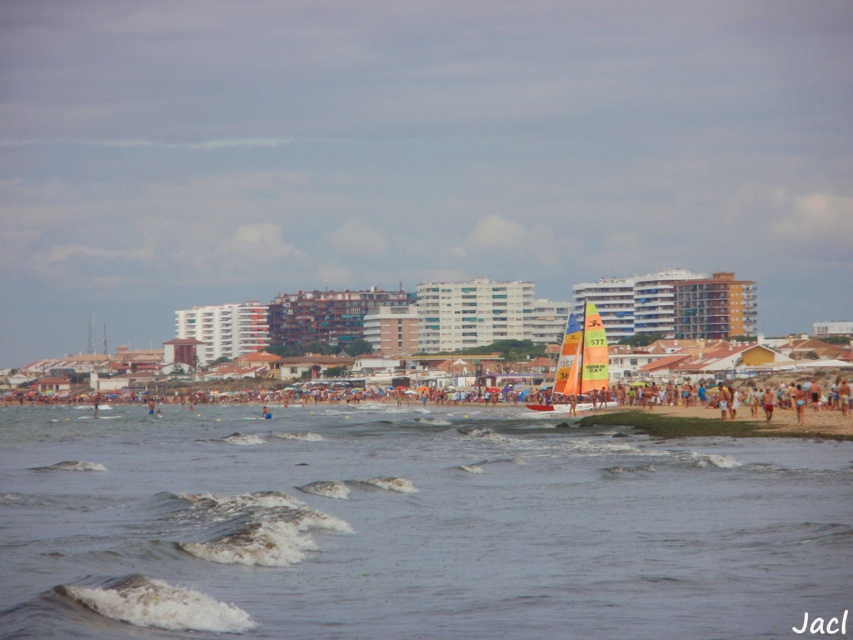
Can you confirm if clear water at lower center is thinner than multicolored sailboat at center?

No, clear water at lower center is not thinner than multicolored sailboat at center.

Between clear water at lower center and multicolored sailboat at center, which one appears on the left side from the viewer's perspective?

clear water at lower center is more to the left.

Describe the element at coordinates (410, 525) in the screenshot. The image size is (853, 640). I see `clear water at lower center` at that location.

Locate an element on the screen. This screenshot has width=853, height=640. clear water at lower center is located at coordinates (410, 525).

Between orange fabric sailboat at center and multicolored sailboat at center, which one is positioned lower?

Positioned lower is orange fabric sailboat at center.

Does orange fabric sailboat at center have a larger size compared to multicolored sailboat at center?

Yes, orange fabric sailboat at center is bigger than multicolored sailboat at center.

Measure the distance between orange fabric sailboat at center and camera.

orange fabric sailboat at center is 380.58 feet from camera.

In order to click on orange fabric sailboat at center in this screenshot , I will do `click(672, 410)`.

Is point (231, 577) farther from camera compared to point (663, 406)?

No, it is in front of (663, 406).

Describe the element at coordinates (410, 525) in the screenshot. I see `clear water at lower center` at that location.

Locate an element on the screen. The width and height of the screenshot is (853, 640). clear water at lower center is located at coordinates (410, 525).